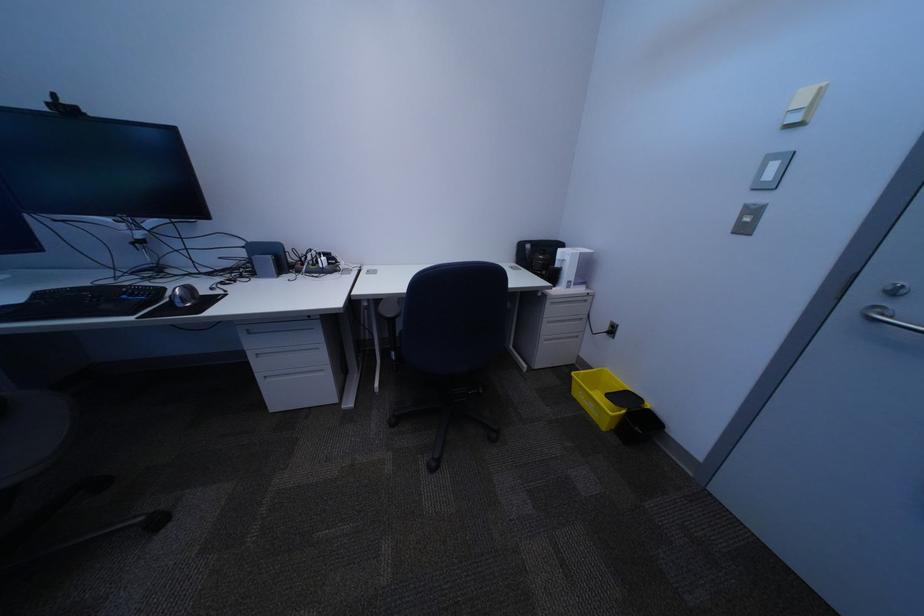
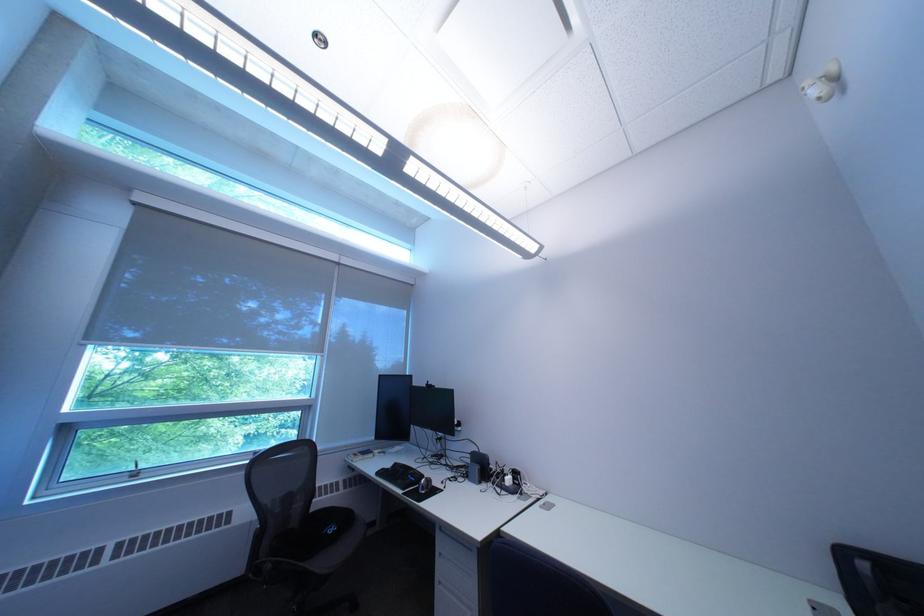
The point at (280, 387) is marked in the first image. Where is the corresponding point in the second image?

(454, 592)